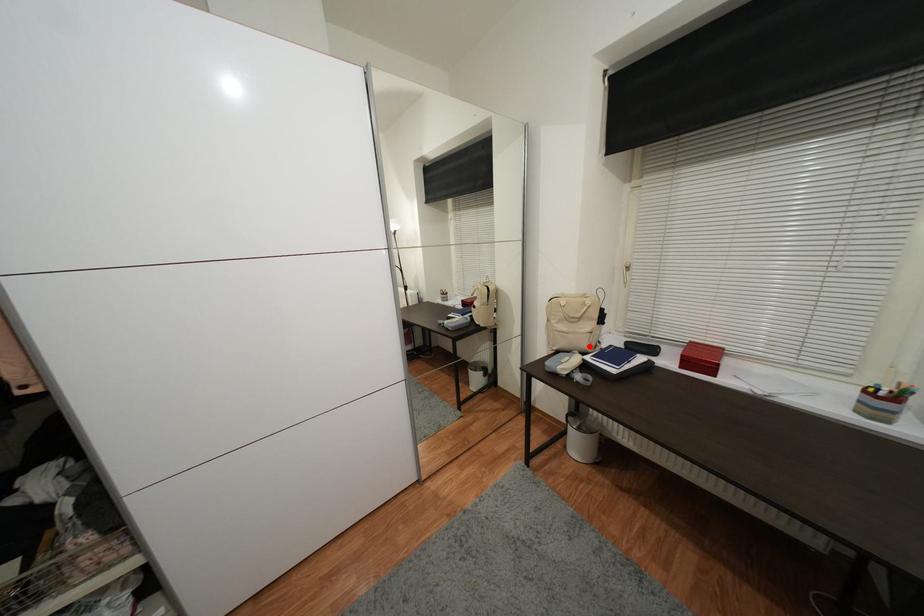
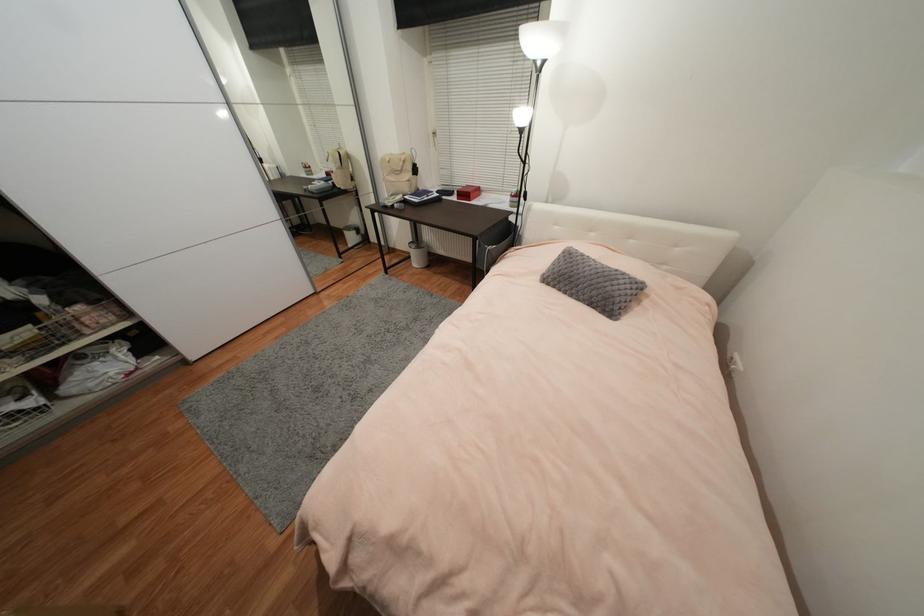
Locate, in the second image, the point that corresponds to the highlighted location in the first image.

(410, 191)